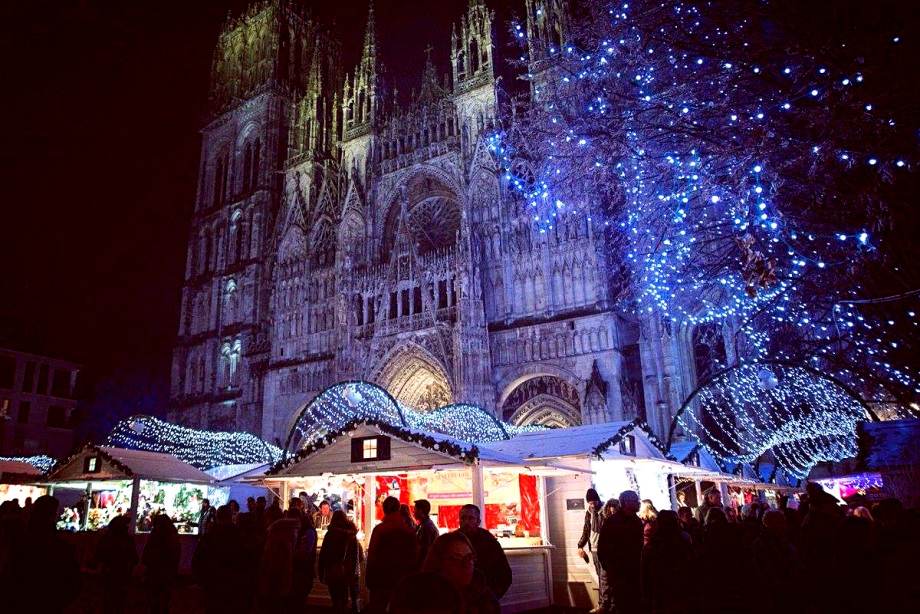
At what (x,y) coordinates should I click in order to perform the action: click on strands of lights. Please return your answer as a coordinate pair (x, y). Looking at the image, I should click on (776, 403).